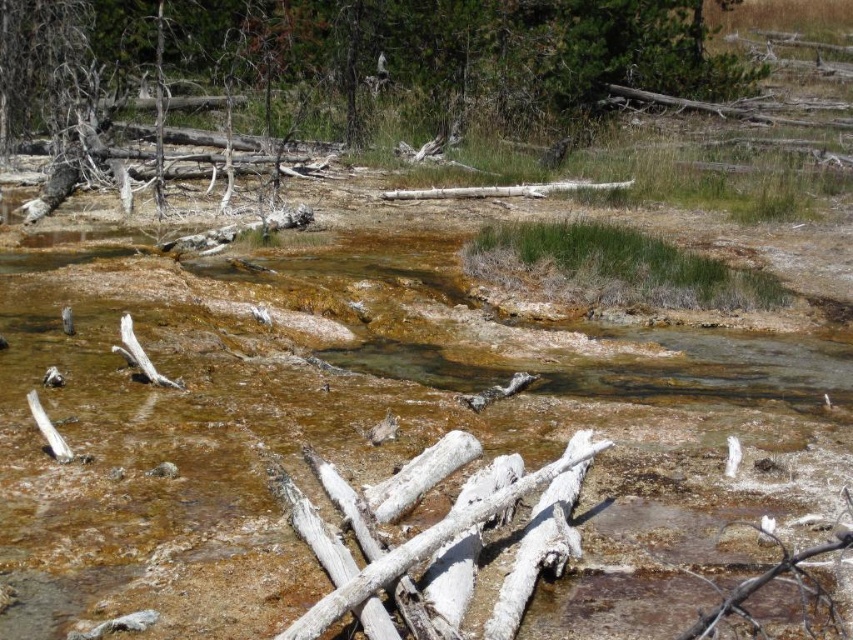
You are standing at the point with coordinates point (361, 596) and want to walk to the point with coordinates point (126, 36). Is the destination point behind you or in front of you?

The destination point point (126, 36) is behind point (361, 596), so it is behind you.

You are standing at the point with coordinates point [376,435] in the geothermal area. What is the main feature located at that point?

The point [376,435] corresponds to the brown sedimentary stream at center.

You are a geologist examining the brown sedimentary stream at center and the dead wood log at upper center. Which object is smaller in size?

The brown sedimentary stream at center is smaller in size compared to the dead wood log at upper center.